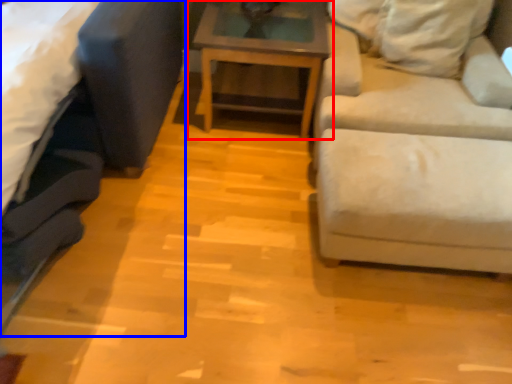
Question: Which object appears farthest to the camera in this image, table (highlighted by a red box) or studio couch (highlighted by a blue box)?

Choices:
 (A) table
 (B) studio couch

Answer: (A)